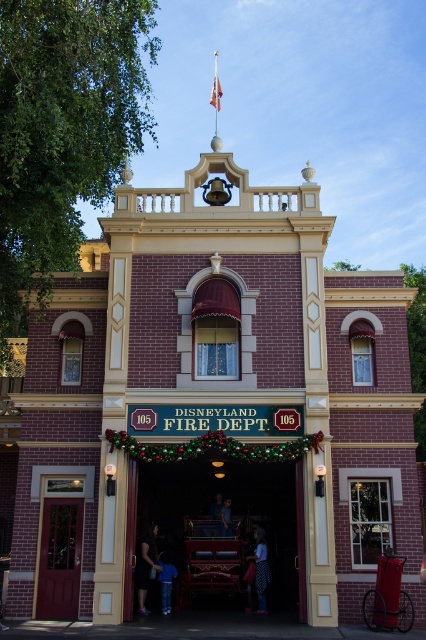
I want to click on dotted fabric dress at center, so click(261, 568).

Describe the element at coordinates (261, 568) in the screenshot. The height and width of the screenshot is (640, 426). I see `dotted fabric dress at center` at that location.

At what (x,y) coordinates should I click in order to perform the action: click on dotted fabric dress at center. Please return your answer as a coordinate pair (x, y). The height and width of the screenshot is (640, 426). Looking at the image, I should click on (261, 568).

Can you confirm if shiny red fire truck at center is bigger than matte red door at center?

Yes, shiny red fire truck at center is bigger than matte red door at center.

Who is more distant from viewer, (256, 483) or (51, 534)?

Point (256, 483)

Where is `shiny red fire truck at center`? This screenshot has width=426, height=640. shiny red fire truck at center is located at coordinates (219, 515).

Between matte red door at center and dotted fabric dress at center, which one appears on the right side from the viewer's perspective?

dotted fabric dress at center

Does point (52, 499) lie behind point (256, 545)?

That is False.

Does point (43, 550) lie behind point (265, 554)?

That is False.

At what (x,y) coordinates should I click in order to perform the action: click on matte red door at center. Please return your answer as a coordinate pair (x, y). This screenshot has height=640, width=426. Looking at the image, I should click on (60, 557).